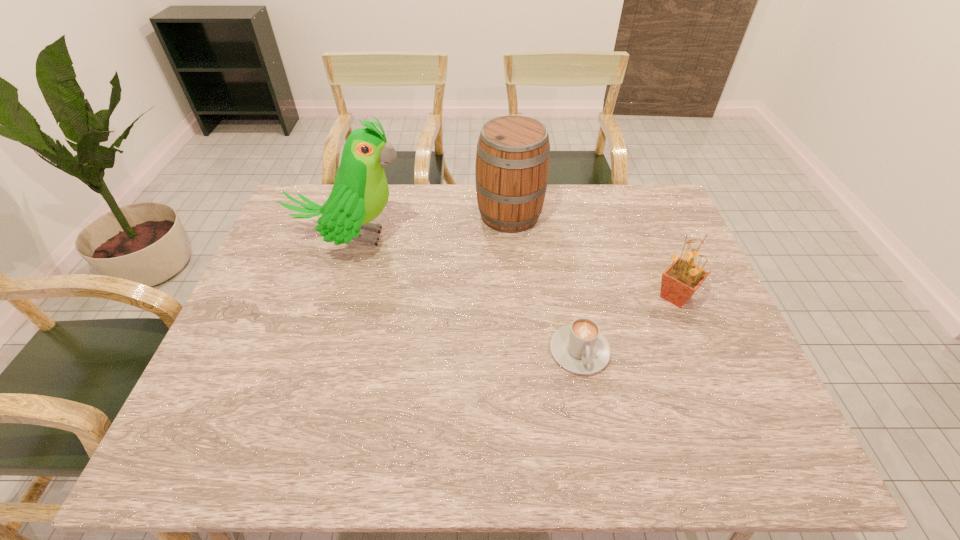
Find the location of a particular element. The height and width of the screenshot is (540, 960). vacant region at the left edge of the desktop is located at coordinates (273, 359).

Locate an element on the screen. This screenshot has width=960, height=540. vacant point at the right edge is located at coordinates (653, 245).

The width and height of the screenshot is (960, 540). Find the location of `free space at the far left corner`. free space at the far left corner is located at coordinates (294, 212).

Where is `vacant space that is in between the sunflower and the cider`? Image resolution: width=960 pixels, height=540 pixels. vacant space that is in between the sunflower and the cider is located at coordinates (592, 256).

At what (x,y) coordinates should I click in order to perform the action: click on unoccupied position between the second nearest object and the nearest object. Please return your answer as a coordinate pair (x, y). The image size is (960, 540). Looking at the image, I should click on tap(628, 324).

At what (x,y) coordinates should I click in order to perform the action: click on empty space between the leftmost object and the third farthest object. Please return your answer as a coordinate pair (x, y). Looking at the image, I should click on (514, 267).

Where is `free space between the third shortest object and the rightmost object`? Image resolution: width=960 pixels, height=540 pixels. free space between the third shortest object and the rightmost object is located at coordinates (592, 256).

Find the location of `empty space between the third tallest object and the tallest object`. empty space between the third tallest object and the tallest object is located at coordinates (514, 267).

Find the location of a particular element. blank region between the cider and the nearest object is located at coordinates (544, 283).

You are a GUI agent. You are given a task and a screenshot of the screen. Output one action in this format:
    pyautogui.click(x=<x>, y=<y>)
    Task: Click on the free space between the tallest object and the cappuccino
    The width and height of the screenshot is (960, 540).
    Given the screenshot: What is the action you would take?
    pyautogui.click(x=466, y=294)